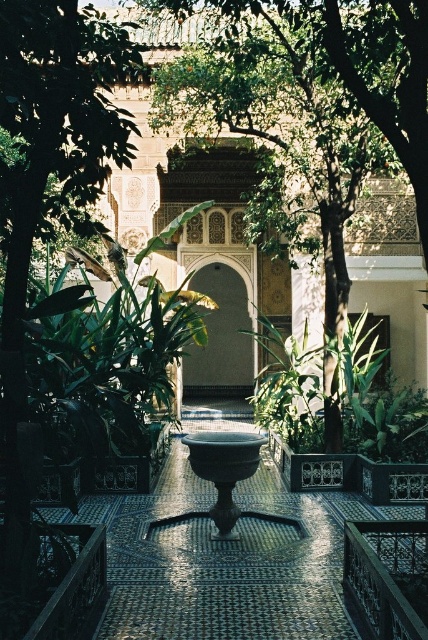
Based on the photo, you are standing in the courtyard and want to walk towards the archway. Which direction should you head to reach the point on the archway labeled as point (x=220, y=339)?

The point (x=220, y=339) is located on the matte stone archway at center, so you should head towards the center of the courtyard to reach it.

You are standing in the courtyard and want to take a photo of both the green leafy tree at center and the matte stone archway at center. Which object should you focus on first to ensure both are in clear view?

Since the green leafy tree at center is closer to the viewer than the matte stone archway at center, you should focus on the matte stone archway at center first to ensure both are in clear view.

You are standing in the courtyard and want to place a small statue between the green leafy tree at center and the bronze bowl at center. Based on their positions, which object should the statue be closer to?

The green leafy tree at center is to the right of the bronze bowl at center, so placing the statue between them would require positioning it closer to the bronze bowl at center since the tree is positioned to its right.